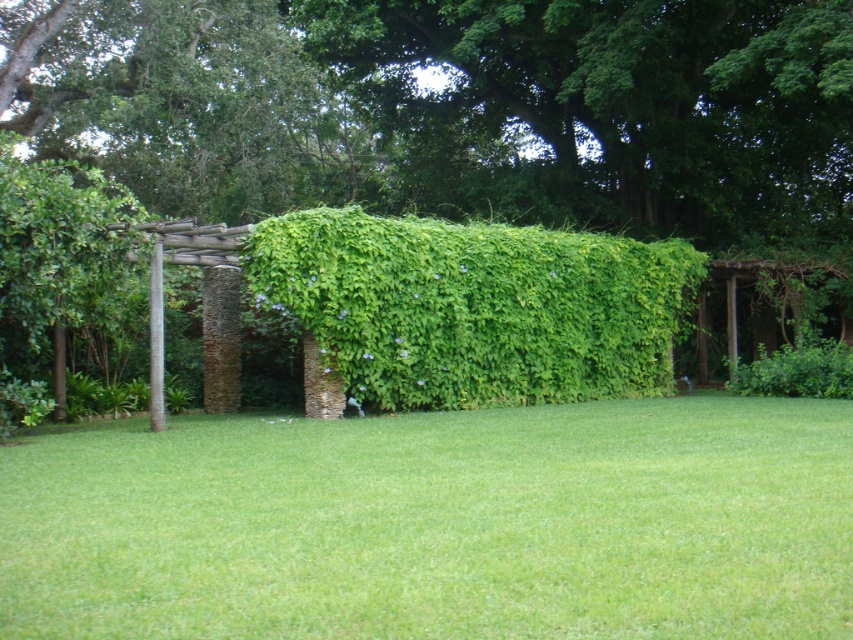
Who is shorter, green grass at center or green leafy hedge at center?

With less height is green grass at center.

Between green grass at center and green leafy hedge at center, which one appears on the right side from the viewer's perspective?

Positioned to the right is green leafy hedge at center.

Who is more distant from viewer, (30, 524) or (297, 225)?

The point (297, 225) is behind.

At what (x,y) coordinates should I click in order to perform the action: click on green grass at center. Please return your answer as a coordinate pair (x, y). The height and width of the screenshot is (640, 853). Looking at the image, I should click on (437, 524).